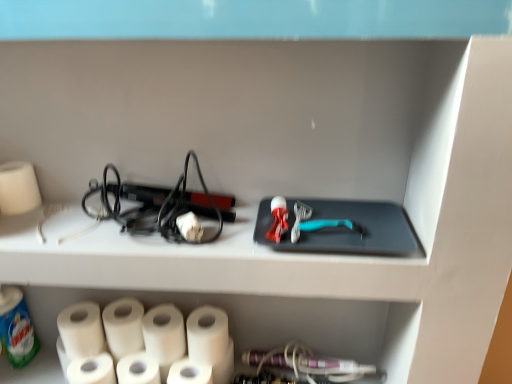
Question: In terms of size, does white matte toilet paper at lower left appear bigger or smaller than white matte paper towel at lower center, which ranks as the second paper towel in right-to-left order?

Choices:
 (A) big
 (B) small

Answer: (B)

Question: From a real-world perspective, is white matte toilet paper at lower left above or below white matte paper towel at lower center, which ranks as the second paper towel in right-to-left order?

Choices:
 (A) above
 (B) below

Answer: (B)

Question: Which is farther from the white matte paper towel at lower left, the 3th paper towel positioned from the left?

Choices:
 (A) white matte paper towel at lower left, the fourth paper towel in the right-to-left sequence
 (B) white matte toilet paper at lower left
 (C) white matte paper towel at lower center, the third paper towel from the right
 (D) white matte paper towel at lower center, the 1th paper towel when ordered from right to left
 (E) white matte paper towel at lower center, which ranks as the second paper towel in right-to-left order

Answer: (D)

Question: Which object is the closest to the white matte toilet paper at lower left?

Choices:
 (A) white matte paper towel at left, the 1th paper towel from the left
 (B) white matte paper towel at lower left, which is the 2th paper towel in left-to-right order
 (C) white matte paper towel at lower left, marked as the 4th paper towel in a left-to-right arrangement
 (D) white matte paper towel at lower center, which ranks as the second paper towel in right-to-left order
 (E) white matte paper towel at lower center, the third paper towel from the right

Answer: (B)